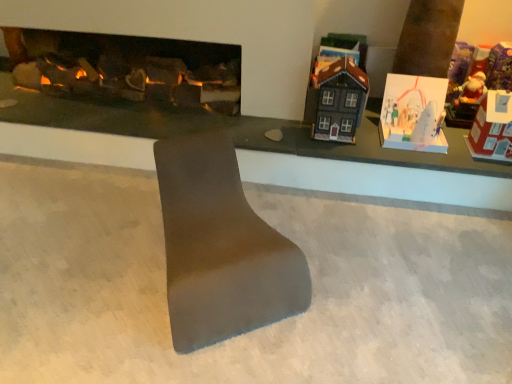
I want to click on empty space that is to the right of matte gray footrest at center, so click(x=361, y=271).